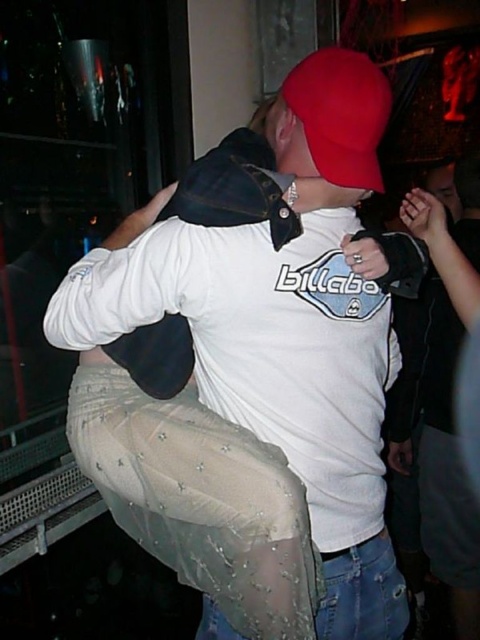
You are at a party and want to take a photo of the white matte shirt at center and the red matte baseball hat at upper center. To ensure both are in frame, should you adjust your camera to focus more to the left or the right?

The white matte shirt at center is positioned on the left side of the red matte baseball hat at upper center, so to capture both in frame, you should adjust your camera to focus more to the left to include the white matte shirt at center and the red matte baseball hat at upper center.

You are at a party and want to take a photo of the white matte shirt at center and the red matte baseball hat at upper center. Which object should you focus on first if you want to capture both in one shot without moving the camera?

The white matte shirt at center is much taller than the red matte baseball hat at upper center, so you should focus on the white matte shirt at center first to ensure it is in frame and properly exposed before adjusting for the other object.

You are at a party and want to take a photo of the white matte shirt at center and the red matte baseball hat at upper center. Which object should you focus on first if you want to capture both in the same frame without moving the camera?

The white matte shirt at center is wider than the red matte baseball hat at upper center, so you should focus on the white matte shirt at center first to ensure it fits within the frame.